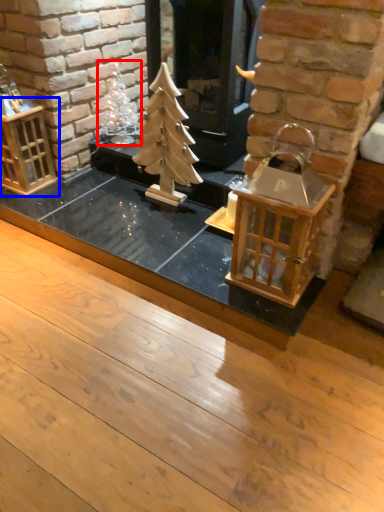
Question: Which object is further to the camera taking this photo, christmas decoration (highlighted by a red box) or cage (highlighted by a blue box)?

Choices:
 (A) christmas decoration
 (B) cage

Answer: (A)